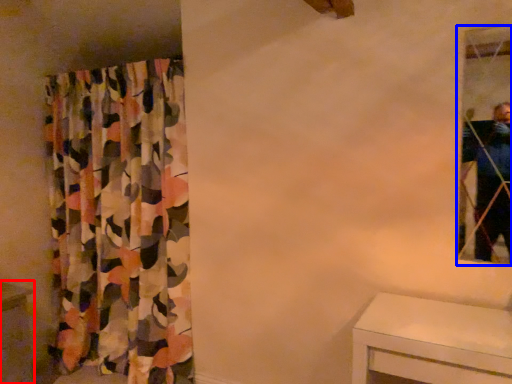
Question: Among these objects, which one is farthest to the camera, vanity (highlighted by a red box) or mirror (highlighted by a blue box)?

Choices:
 (A) vanity
 (B) mirror

Answer: (A)